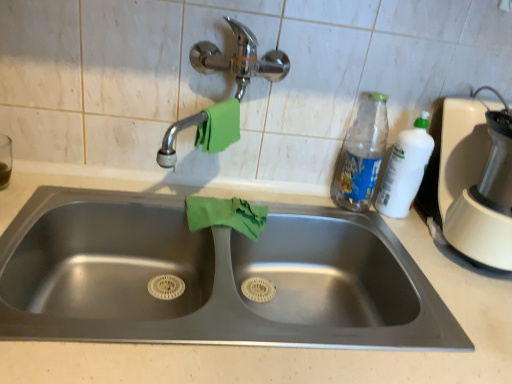
Question: Is white plastic blender at right thinner than stainless steel sink at center?

Choices:
 (A) yes
 (B) no

Answer: (A)

Question: Is white plastic blender at right surrounding stainless steel sink at center?

Choices:
 (A) no
 (B) yes

Answer: (A)

Question: Is white plastic blender at right taller than stainless steel sink at center?

Choices:
 (A) no
 (B) yes

Answer: (B)

Question: Does white plastic blender at right have a larger size compared to stainless steel sink at center?

Choices:
 (A) yes
 (B) no

Answer: (B)

Question: Is white plastic blender at right shorter than stainless steel sink at center?

Choices:
 (A) yes
 (B) no

Answer: (B)

Question: Based on their positions, is white plastic blender at right located to the left or right of stainless steel sink at center?

Choices:
 (A) left
 (B) right

Answer: (B)

Question: Looking at the image, does white plastic blender at right seem bigger or smaller compared to stainless steel sink at center?

Choices:
 (A) small
 (B) big

Answer: (A)

Question: In terms of height, does white plastic blender at right look taller or shorter compared to stainless steel sink at center?

Choices:
 (A) tall
 (B) short

Answer: (A)

Question: Is white plastic blender at right situated inside stainless steel sink at center or outside?

Choices:
 (A) outside
 (B) inside

Answer: (A)

Question: From the image's perspective, is white plastic blender at right positioned above or below translucent plastic bottle at upper right?

Choices:
 (A) below
 (B) above

Answer: (A)

Question: From a real-world perspective, relative to translucent plastic bottle at upper right, is white plastic blender at right vertically above or below?

Choices:
 (A) below
 (B) above

Answer: (B)

Question: Is white plastic blender at right in front of or behind translucent plastic bottle at upper right in the image?

Choices:
 (A) behind
 (B) front

Answer: (B)

Question: Is white plastic blender at right inside or outside of translucent plastic bottle at upper right?

Choices:
 (A) outside
 (B) inside

Answer: (A)

Question: From their relative heights in the image, would you say stainless steel sink at center is taller or shorter than white plastic blender at right?

Choices:
 (A) tall
 (B) short

Answer: (B)

Question: From the image's perspective, is stainless steel sink at center positioned above or below white plastic blender at right?

Choices:
 (A) above
 (B) below

Answer: (B)